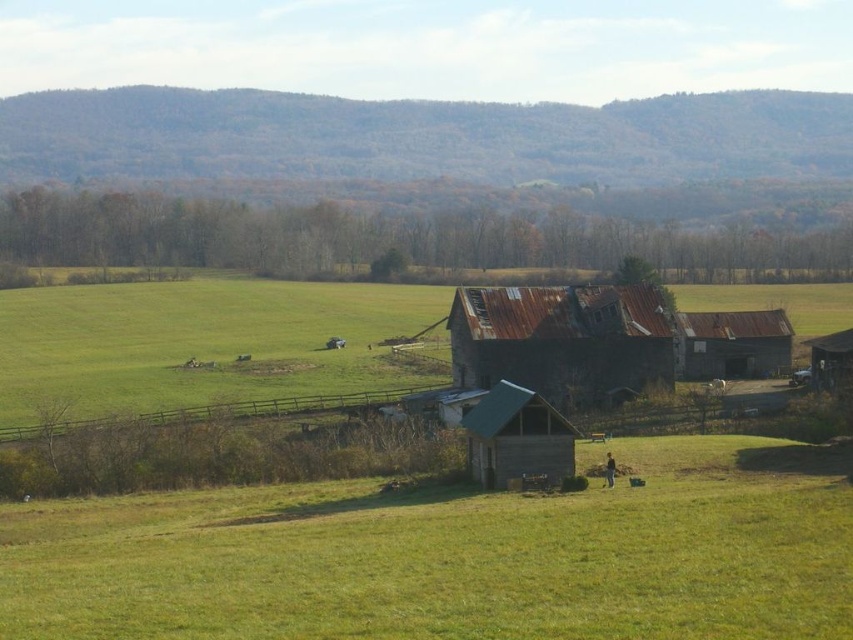
Question: Which is farther from the rusty metal barn at center?

Choices:
 (A) rusty metal hut at center
 (B) rusty metal barn at center-right

Answer: (A)

Question: Among these points, which one is nearest to the camera?

Choices:
 (A) (633, 317)
 (B) (683, 369)
 (C) (122, 525)

Answer: (C)

Question: Considering the real-world distances, which object is farthest from the rusty metal hut at center?

Choices:
 (A) green grassy field at lower center
 (B) rusty metal barn at center

Answer: (B)

Question: Where is rusty metal barn at center located in relation to rusty metal barn at center-right in the image?

Choices:
 (A) below
 (B) above

Answer: (A)

Question: Where is green grassy field at lower center located in relation to rusty metal barn at center-right in the image?

Choices:
 (A) left
 (B) right

Answer: (A)

Question: Can you confirm if green grassy field at lower center is positioned below rusty metal hut at center?

Choices:
 (A) no
 (B) yes

Answer: (B)